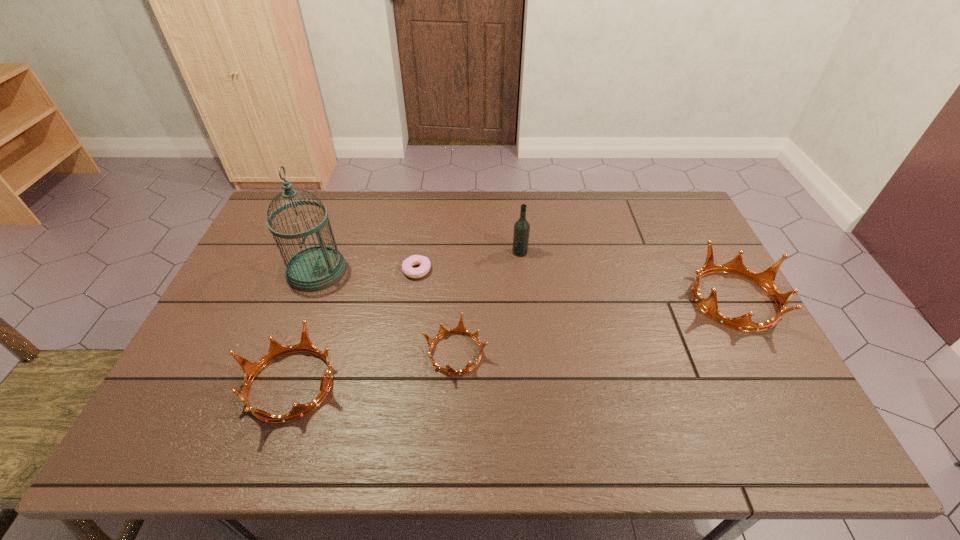
You are a GUI agent. You are given a task and a screenshot of the screen. Output one action in this format:
    pyautogui.click(x=<x>, y=<y>)
    Task: Click on the vacant area that satisfies the following two spatial constraints: 1. on the back side of the third object from left to right; 2. on the right side of the second shortest crown
    
    Given the screenshot: What is the action you would take?
    tap(330, 271)

Locate an element on the screen. This screenshot has width=960, height=540. free space that satisfies the following two spatial constraints: 1. on the back side of the leftmost crown; 2. on the right side of the second crown from right to left is located at coordinates (301, 353).

Where is `vacant space that satisfies the following two spatial constraints: 1. on the front side of the doughnut; 2. on the right side of the fifth tallest object`? vacant space that satisfies the following two spatial constraints: 1. on the front side of the doughnut; 2. on the right side of the fifth tallest object is located at coordinates pyautogui.click(x=405, y=353).

Find the location of `free space that satisfies the following two spatial constraints: 1. on the back side of the fourth tallest object; 2. on the left side of the vodka`. free space that satisfies the following two spatial constraints: 1. on the back side of the fourth tallest object; 2. on the left side of the vodka is located at coordinates (336, 252).

The image size is (960, 540). I want to click on vacant space that satisfies the following two spatial constraints: 1. on the front-facing side of the rightmost crown; 2. on the left side of the birdcage, so click(305, 300).